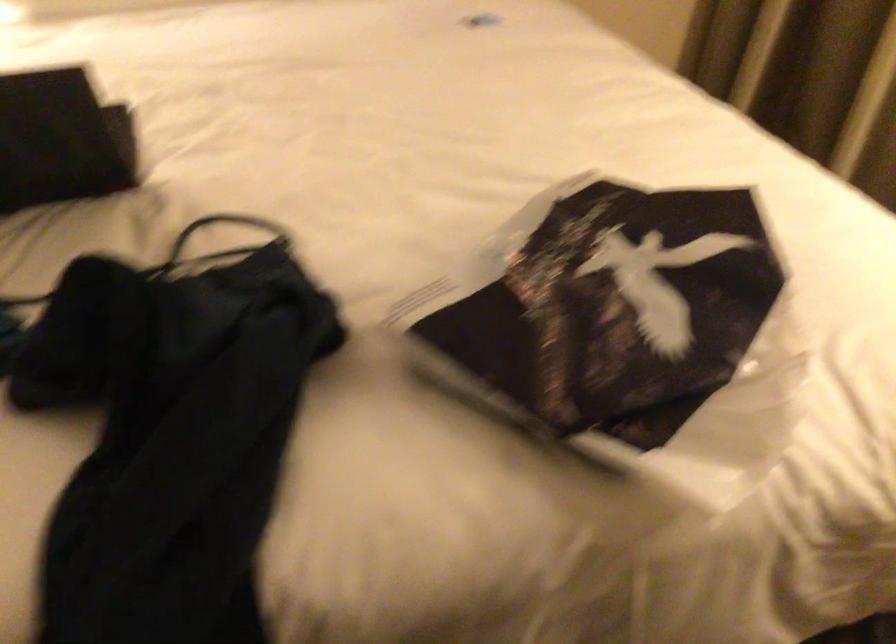
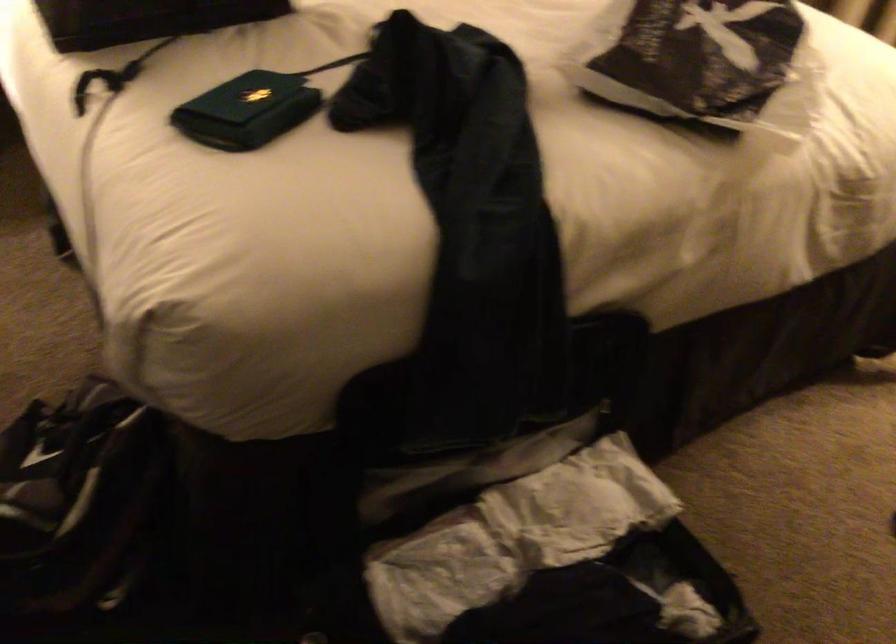
Question: The camera is either moving clockwise (left) or counter-clockwise (right) around the object. The first image is from the beginning of the video and the second image is from the end. Is the camera moving left or right when shooting the video?

Choices:
 (A) Left
 (B) Right

Answer: (A)